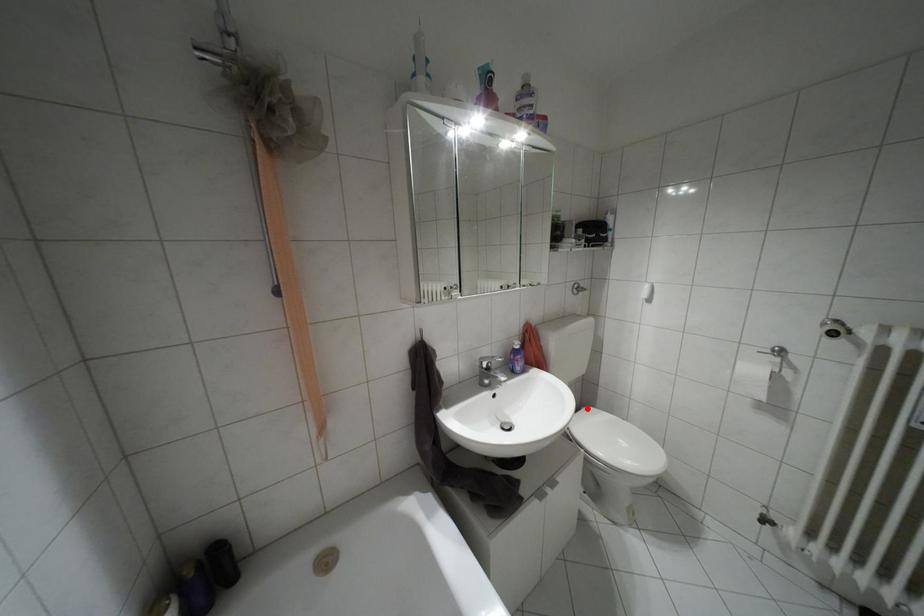
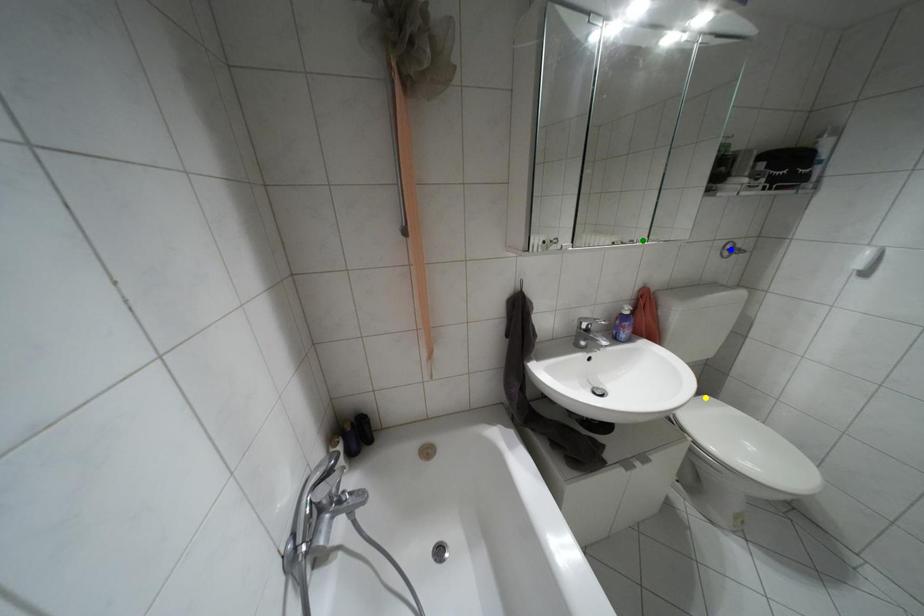
Question: I am providing you with two images of the same scene from different viewpoints. A red point is marked on the first image. You are given multiple points on the second image. Which spot in image 2 lines up with the point in image 1?

Choices:
 (A) yellow point
 (B) blue point
 (C) green point

Answer: (A)